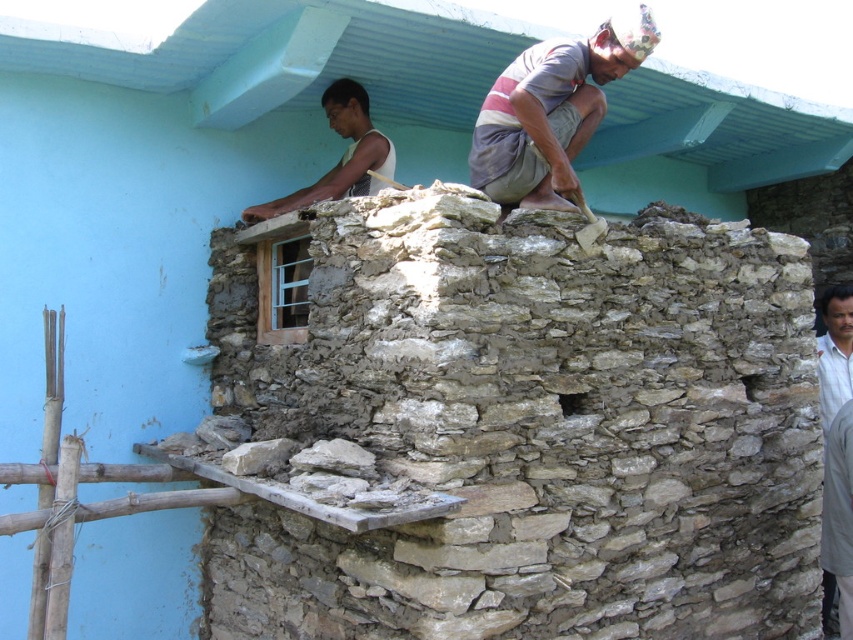
Question: Does white matte shirt at upper center have a larger size compared to light brown textured shirt at right?

Choices:
 (A) yes
 (B) no

Answer: (B)

Question: Is gray cotton shirt at upper right to the right of light brown textured shirt at right from the viewer's perspective?

Choices:
 (A) no
 (B) yes

Answer: (B)

Question: Is striped fabric headband at upper center positioned at the back of light brown textured shirt at right?

Choices:
 (A) no
 (B) yes

Answer: (A)

Question: Which point is closer to the camera?

Choices:
 (A) white matte shirt at upper center
 (B) striped fabric headband at upper center

Answer: (B)

Question: Which point is closer to the camera?

Choices:
 (A) (831, 316)
 (B) (519, 193)
 (C) (833, 316)

Answer: (B)

Question: Which is farther from the striped fabric headband at upper center?

Choices:
 (A) white matte shirt at upper center
 (B) gray cotton shirt at upper right
 (C) natural stone wall at upper center

Answer: (B)